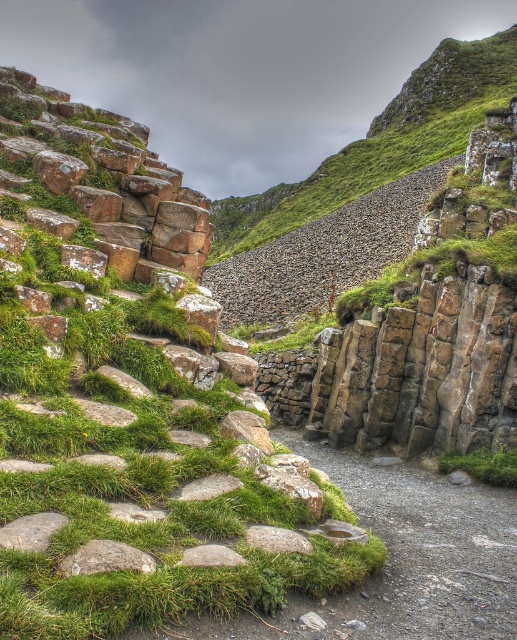
You are a hiker trying to navigate the stone staircase. You notice a green mossy rock at left and a green mossy stone path at center. Which one is closer to your current position?

The green mossy rock at left is closer to your current position because it is in front of the green mossy stone path at center.

You are hiking and need to cross from the green mossy stone path at center to the green grass at lower center. Which direction should you move to reach the grass?

You should move to the right side to reach the green grass at lower center since the green mossy stone path at center is on the left side of it.

You are a hiker trying to navigate through the rocky terrain. You notice the green mossy rock at left and the green mossy stone path at center. Which one is wider?

The green mossy rock at left is wider than the green mossy stone path at center.